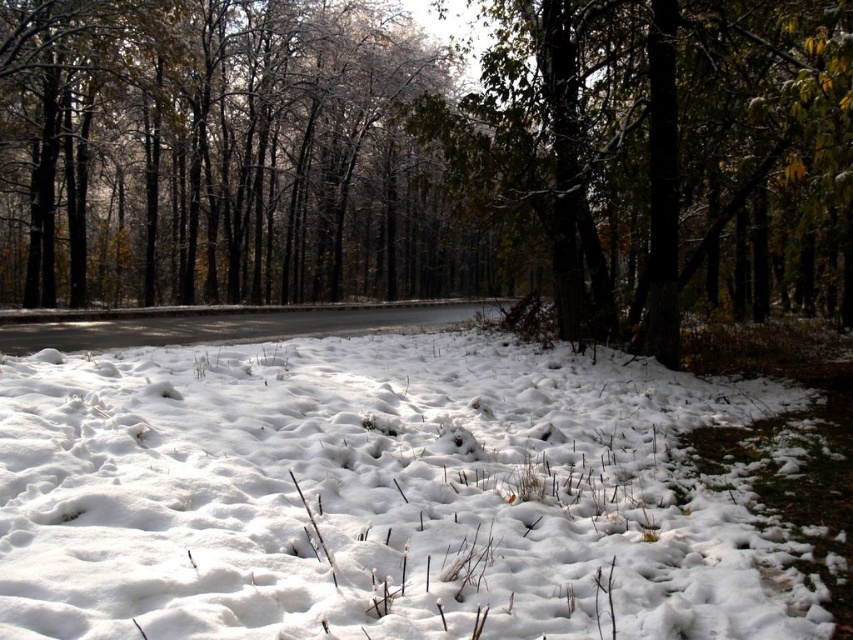
Between frosty bark trees at center and snow-covered tree at center, which one has less height?

snow-covered tree at center

In order to click on frosty bark trees at center in this screenshot , I will do `click(221, 154)`.

From the picture: Who is more distant from viewer, (405, 161) or (583, 273)?

Point (405, 161)

Locate an element on the screen. Image resolution: width=853 pixels, height=640 pixels. frosty bark trees at center is located at coordinates (221, 154).

Can you confirm if white fluffy snow at center is positioned to the left of snow-covered tree at center?

Indeed, white fluffy snow at center is positioned on the left side of snow-covered tree at center.

Does white fluffy snow at center have a lesser height compared to snow-covered tree at center?

Yes, white fluffy snow at center is shorter than snow-covered tree at center.

Which is behind, point (271, 600) or point (811, 248)?

The point (811, 248) is behind.

Image resolution: width=853 pixels, height=640 pixels. In order to click on white fluffy snow at center in this screenshot , I will do click(379, 497).

Which is above, white fluffy snow at center or frosty bark trees at center?

Positioned higher is frosty bark trees at center.

Does white fluffy snow at center have a larger size compared to frosty bark trees at center?

Incorrect, white fluffy snow at center is not larger than frosty bark trees at center.

Who is more distant from viewer, (x=28, y=410) or (x=113, y=3)?

Positioned behind is point (x=113, y=3).

You are a GUI agent. You are given a task and a screenshot of the screen. Output one action in this format:
    pyautogui.click(x=<x>, y=<y>)
    Task: Click on the white fluffy snow at center
    
    Given the screenshot: What is the action you would take?
    pyautogui.click(x=379, y=497)